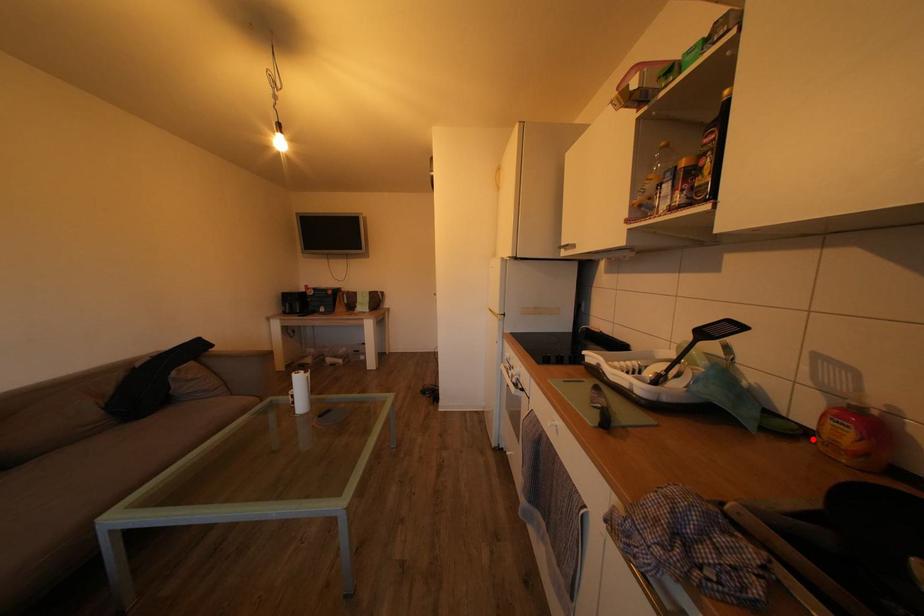
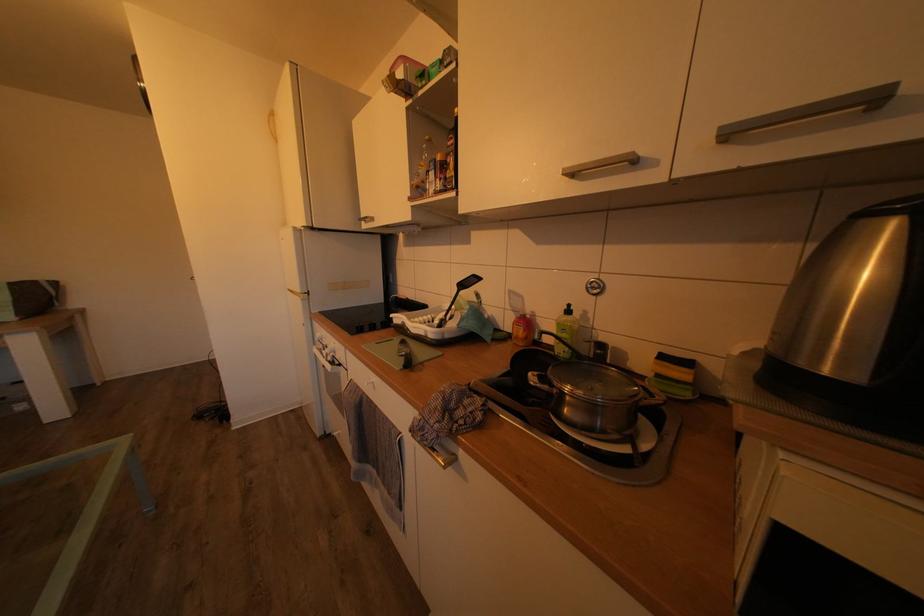
The point at the highlighted location is marked in the first image. Where is the corresponding point in the second image?

(517, 342)